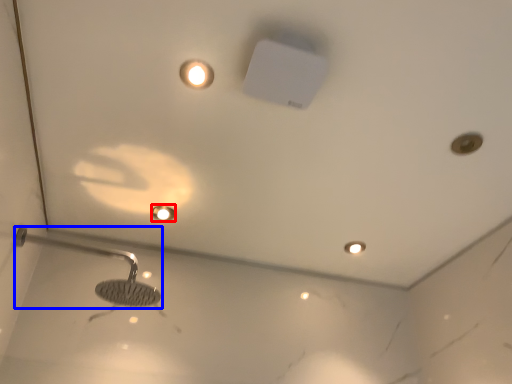
Question: Which of the following is the closest to the observer, droplight (highlighted by a red box) or shower (highlighted by a blue box)?

Choices:
 (A) droplight
 (B) shower

Answer: (B)